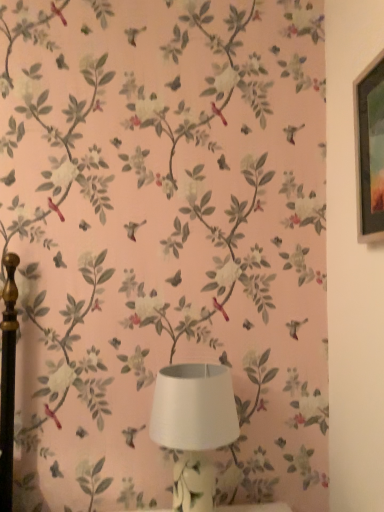
Question: Would you say metallic silver picture frame at upper right is to the left or to the right of white matte lampshade at center in the picture?

Choices:
 (A) left
 (B) right

Answer: (B)

Question: From a real-world perspective, is metallic silver picture frame at upper right above or below white matte lampshade at center?

Choices:
 (A) above
 (B) below

Answer: (A)

Question: From the image's perspective, is metallic silver picture frame at upper right above or below white matte lampshade at center?

Choices:
 (A) below
 (B) above

Answer: (B)

Question: Is white matte lampshade at center inside or outside of metallic silver picture frame at upper right?

Choices:
 (A) outside
 (B) inside

Answer: (A)

Question: Considering the positions of white matte lampshade at center and metallic silver picture frame at upper right in the image, is white matte lampshade at center taller or shorter than metallic silver picture frame at upper right?

Choices:
 (A) tall
 (B) short

Answer: (B)

Question: From the image's perspective, is white matte lampshade at center positioned above or below metallic silver picture frame at upper right?

Choices:
 (A) below
 (B) above

Answer: (A)

Question: Based on their positions, is white matte lampshade at center located to the left or right of metallic silver picture frame at upper right?

Choices:
 (A) right
 (B) left

Answer: (B)